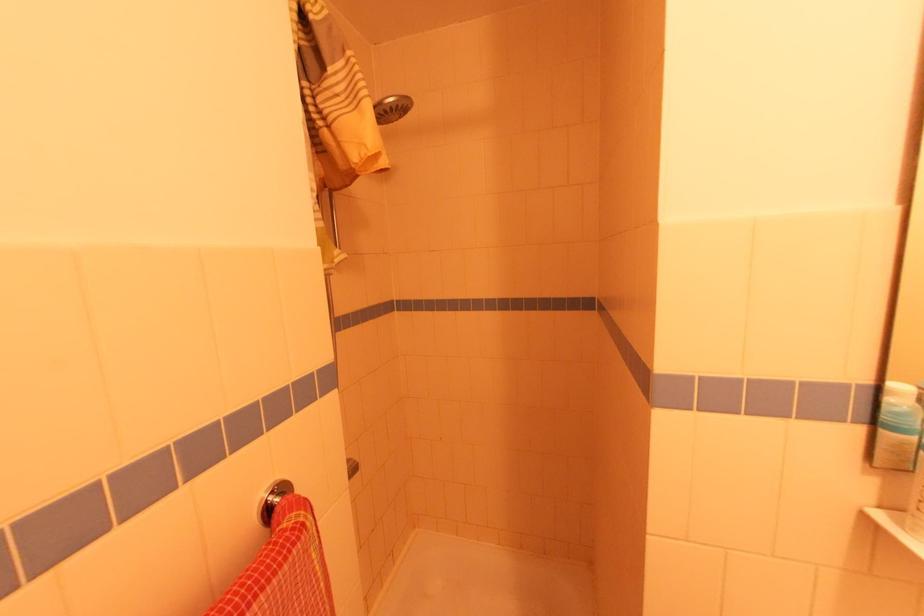
Find where to pull the metal wall hook. Please return your answer as a coordinate pair (x, y).

(273, 499)